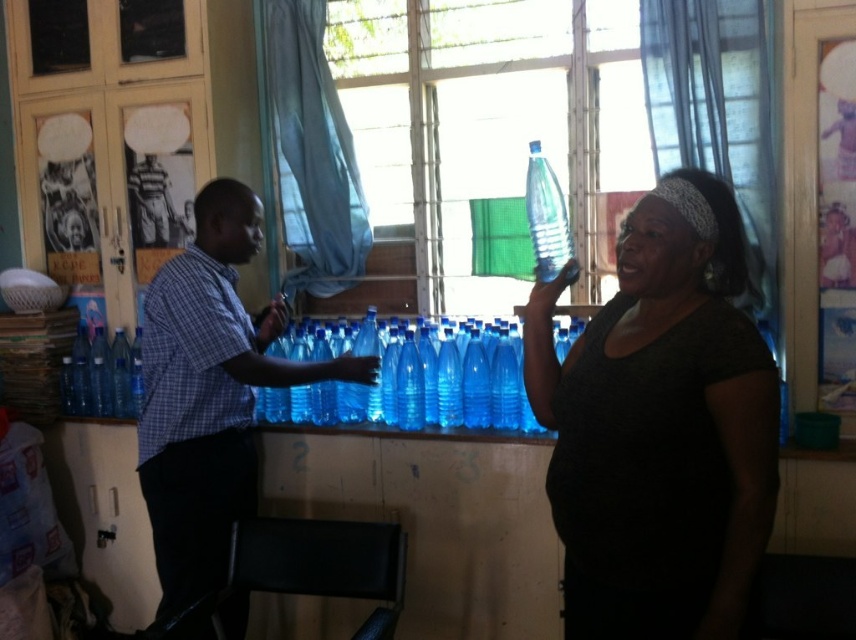
Question: Estimate the real-world distances between objects in this image. Which object is closer to the blue plastic bottle at center?

Choices:
 (A) matte blue water bottles at center
 (B) matte black shirt at center
 (C) blue plastic water bottles at center

Answer: (A)

Question: Can you confirm if blue plastic water bottles at center is positioned to the left of blue plastic bottle at center?

Choices:
 (A) yes
 (B) no

Answer: (B)

Question: Which is farther from the matte black shirt at center?

Choices:
 (A) blue plastic water bottles at center
 (B) matte blue water bottles at center

Answer: (B)

Question: Among these points, which one is nearest to the camera?

Choices:
 (A) (535, 266)
 (B) (163, 262)
 (C) (675, 371)

Answer: (C)

Question: Can you confirm if blue plastic water bottles at center is positioned below matte black shirt at center?

Choices:
 (A) yes
 (B) no

Answer: (B)

Question: Is blue plastic water bottles at center smaller than matte black shirt at center?

Choices:
 (A) no
 (B) yes

Answer: (A)